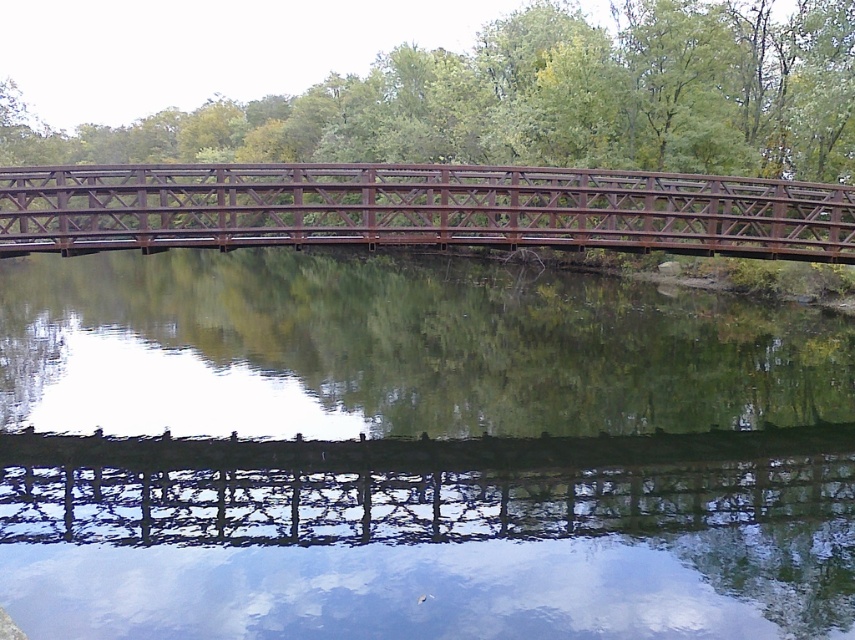
Can you confirm if green reflective water at center is smaller than rusty metal bridge at center?

Correct, green reflective water at center occupies less space than rusty metal bridge at center.

Which is in front, point (773, 456) or point (824, 188)?

Point (773, 456) is more forward.

Is point (155, 424) farther from camera compared to point (420, 168)?

Yes, it is behind point (420, 168).

Locate an element on the screen. green reflective water at center is located at coordinates (416, 452).